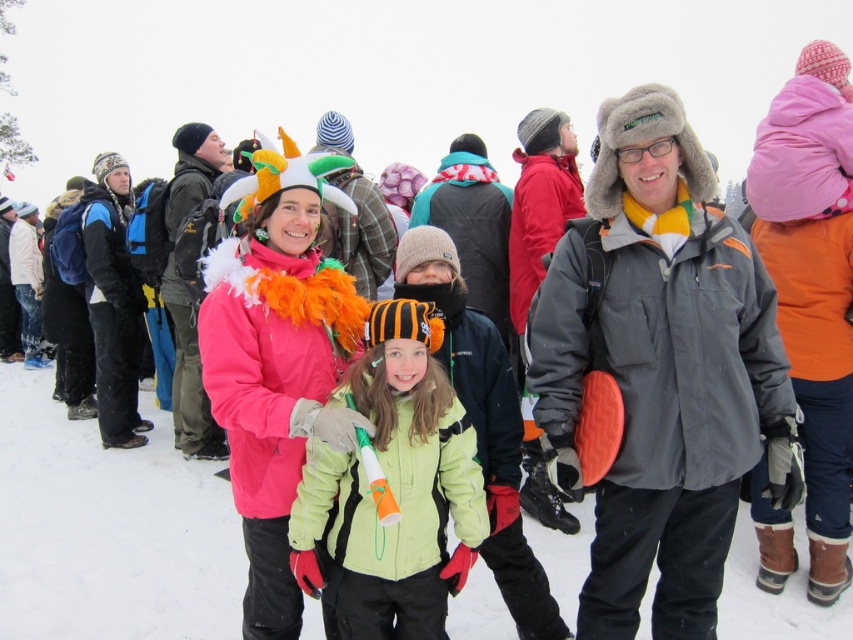
You are a photographer trying to capture the matte pink jacket at center and the light green fleece jacket at center in the same frame. Based on their positions, which jacket is closer to the camera?

The matte pink jacket at center is positioned over the light green fleece jacket at center, so it is closer to the camera.